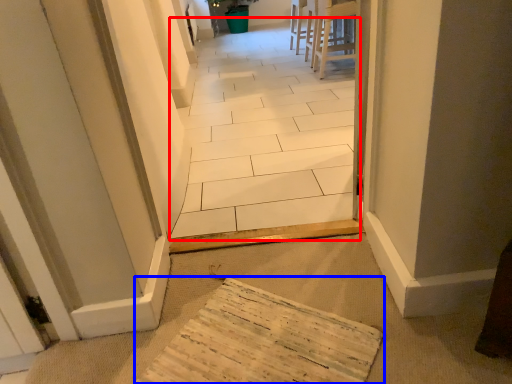
Question: Which point is closer to the camera, path (highlighted by a red box) or cardboard (highlighted by a blue box)?

Choices:
 (A) path
 (B) cardboard

Answer: (B)